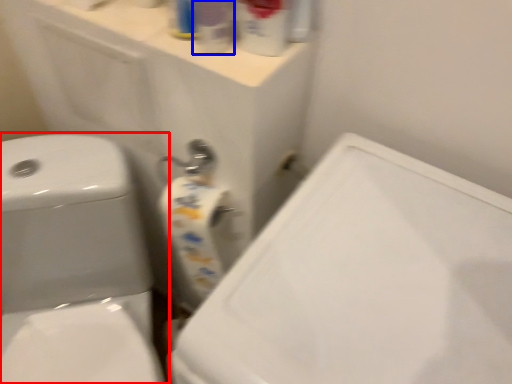
Question: Which object appears farthest to the camera in this image, toilet (highlighted by a red box) or cleaning product (highlighted by a blue box)?

Choices:
 (A) toilet
 (B) cleaning product

Answer: (A)